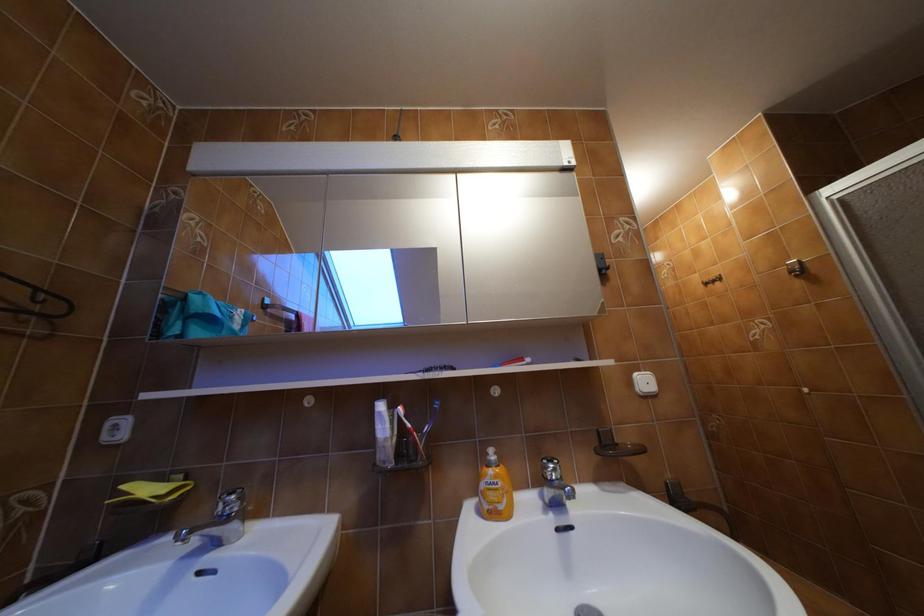
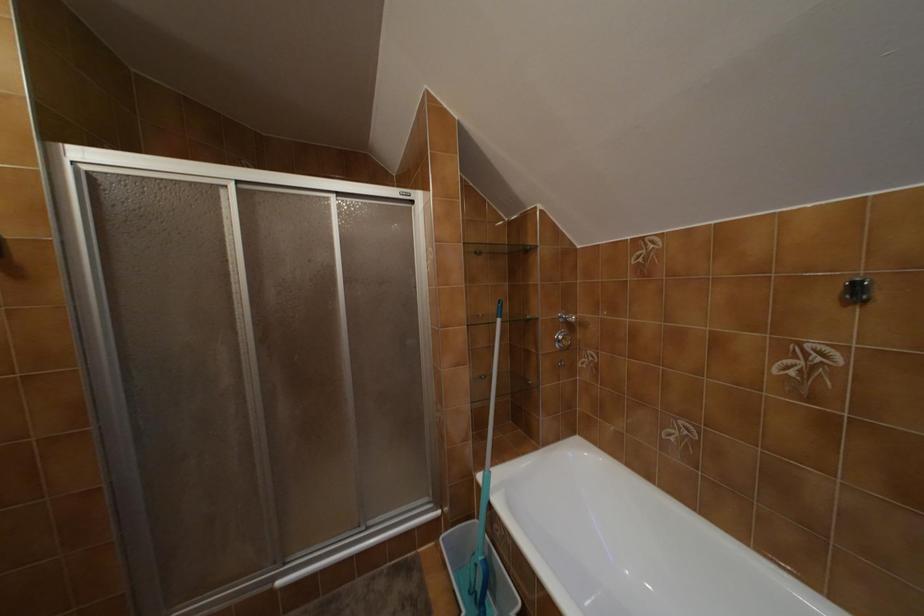
Question: How did the camera likely rotate?

Choices:
 (A) Left
 (B) Right
 (C) Up
 (D) Down

Answer: (B)